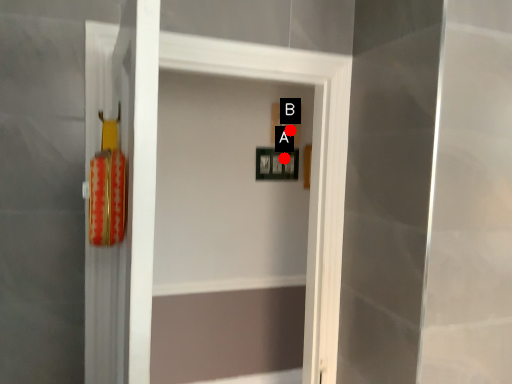
Question: Two points are circled on the image, labeled by A and B beside each circle. Which of the following is the closest to the observer?

Choices:
 (A) A is closer
 (B) B is closer

Answer: (B)